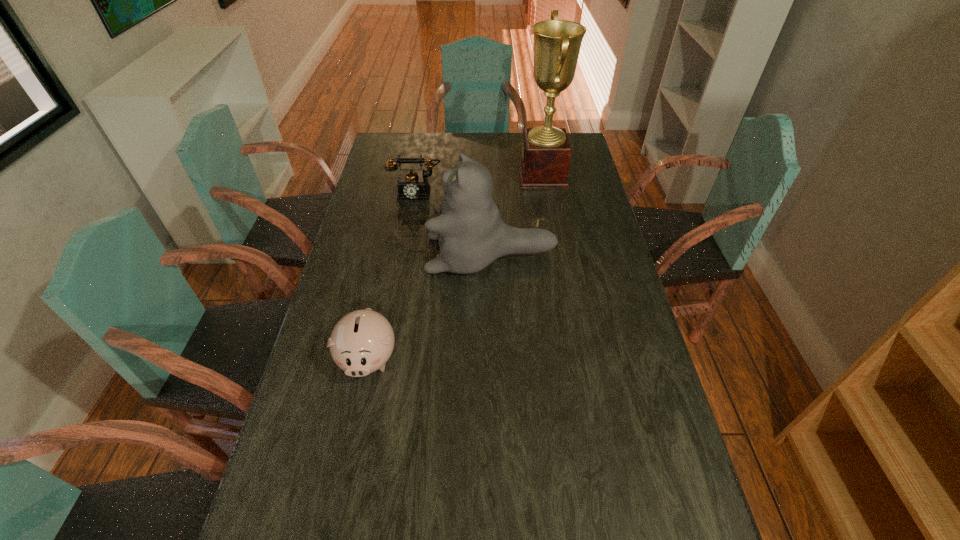
Where is `vacant space at the right edge`? The width and height of the screenshot is (960, 540). vacant space at the right edge is located at coordinates (568, 259).

Identify the location of free space at the far left corner of the desktop. The width and height of the screenshot is (960, 540). (411, 154).

Identify the location of vacant area between the trophy cup and the second tallest object. This screenshot has height=540, width=960. (516, 214).

Identify the location of free spot between the second nearest object and the tallest object. The image size is (960, 540). pos(516,214).

Identify the location of vacant region between the telephone and the piggy bank. The height and width of the screenshot is (540, 960). (393, 274).

Locate an element on the screen. the second closest object to the third shortest object is located at coordinates (362, 341).

Where is `object that can be found as the closest to the tallest object`? This screenshot has width=960, height=540. object that can be found as the closest to the tallest object is located at coordinates (471, 233).